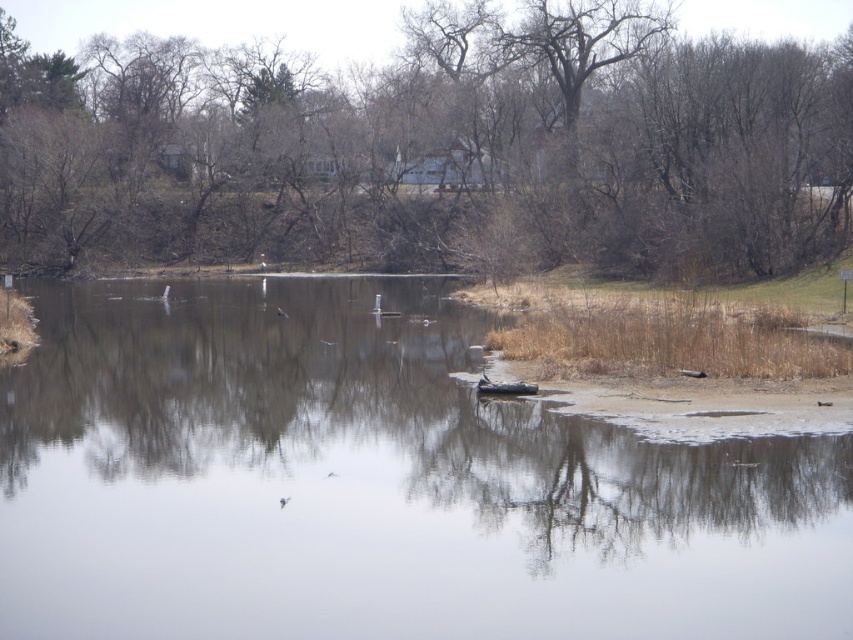
You are standing on the lakeshore and see the transparent ice at center and the rubberized black boat at center. Which object is closer to you?

The transparent ice at center is positioned over the rubberized black boat at center, so the transparent ice at center is closer to you.